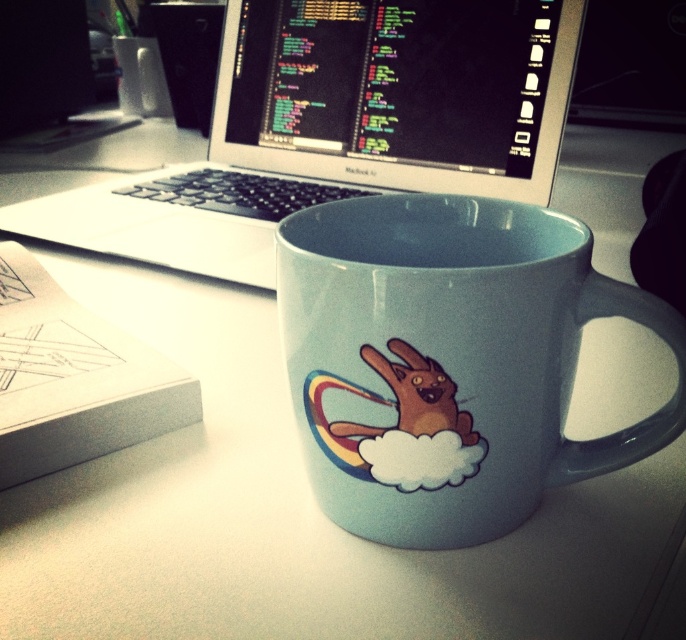
Can you confirm if sleek silver laptop at upper center is smaller than matte plastic laptop at upper center?

No, sleek silver laptop at upper center is not smaller than matte plastic laptop at upper center.

This screenshot has height=640, width=686. Describe the element at coordinates (340, 125) in the screenshot. I see `sleek silver laptop at upper center` at that location.

At what (x,y) coordinates should I click in order to perform the action: click on sleek silver laptop at upper center. Please return your answer as a coordinate pair (x, y). This screenshot has height=640, width=686. Looking at the image, I should click on (340, 125).

Does matte ceramic mug at center have a larger size compared to sleek silver laptop at upper center?

Incorrect, matte ceramic mug at center is not larger than sleek silver laptop at upper center.

Can you confirm if matte ceramic mug at center is positioned below sleek silver laptop at upper center?

Indeed, matte ceramic mug at center is positioned under sleek silver laptop at upper center.

The height and width of the screenshot is (640, 686). I want to click on matte ceramic mug at center, so click(x=449, y=362).

From the picture: Is matte plastic laptop at upper center to the left of matte black monitor at upper left from the viewer's perspective?

No, matte plastic laptop at upper center is not to the left of matte black monitor at upper left.

Is matte plastic laptop at upper center bigger than matte black monitor at upper left?

Yes.

Is point (549, 81) closer to viewer compared to point (62, 100)?

That is True.

The image size is (686, 640). Identify the location of matte plastic laptop at upper center. (399, 92).